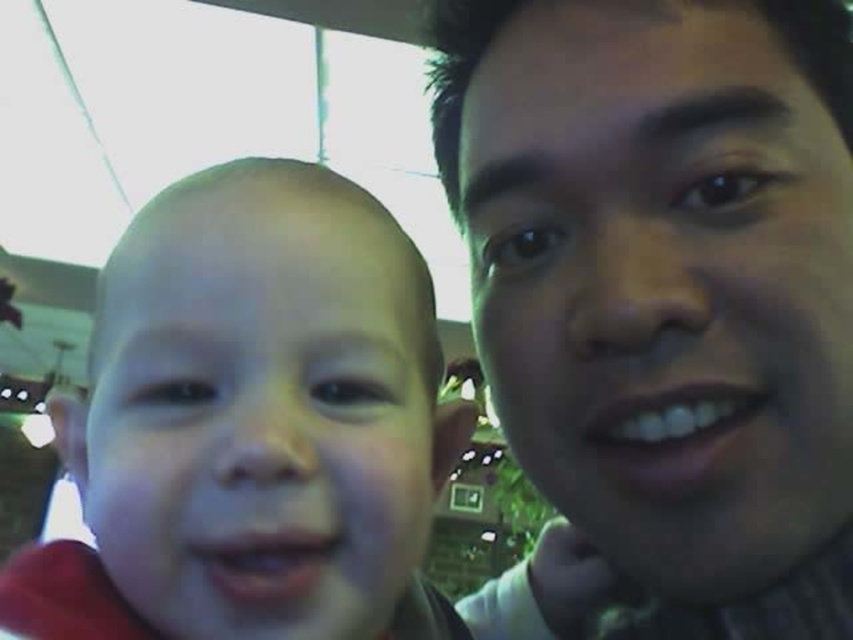
Between point (556, 612) and point (233, 230), which one is positioned in front?

Point (233, 230) is in front.

Does smooth skin face at center appear under smooth skin baby at center?

Incorrect, smooth skin face at center is not positioned below smooth skin baby at center.

Image resolution: width=853 pixels, height=640 pixels. Find the location of `smooth skin face at center`. smooth skin face at center is located at coordinates (662, 301).

I want to click on smooth skin face at center, so click(662, 301).